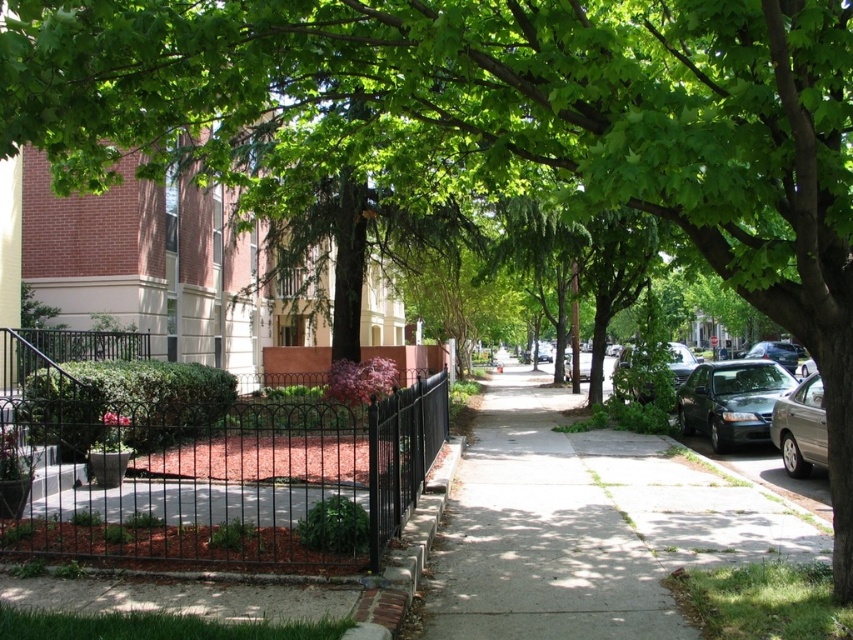
In the scene shown: You are a pedestrian standing on the sidewalk and want to cross the street to reach the fenced garden area. The shiny black sedan at right and the shiny silver sedan at center right are parked along the curb. Which car should you look out for first as you cross?

You should look out for the shiny black sedan at right first because it is closer to you than the shiny silver sedan at center right.

You are a delivery person trying to park your van between the shiny silver sedan at center right and the shiny silver sedan at right. The van is 2.5 meters wide. Can you fit your van between them?

The shiny silver sedan at center right might be wider than shiny silver sedan at right, so it is uncertain if the space between them is sufficient for the van. Check the actual width difference before deciding.

You are a delivery person trying to park your shiny silver sedan at center right on the smooth concrete sidewalk at center. Based on the scene description, will the sedan fit on the sidewalk?

The smooth concrete sidewalk at center is narrower than the shiny silver sedan at center right, so the sedan will not fit on the sidewalk.